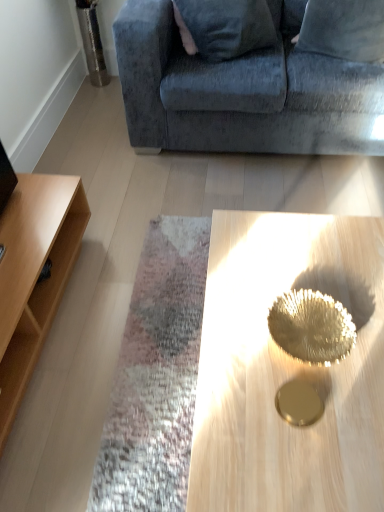
Question: Can you confirm if velvet blue couch at upper center is bigger than gold metallic tray at center?

Choices:
 (A) no
 (B) yes

Answer: (B)

Question: Considering the relative sizes of velvet blue couch at upper center and gold metallic tray at center in the image provided, is velvet blue couch at upper center thinner than gold metallic tray at center?

Choices:
 (A) no
 (B) yes

Answer: (A)

Question: Does velvet blue couch at upper center have a lesser height compared to gold metallic tray at center?

Choices:
 (A) yes
 (B) no

Answer: (B)

Question: From a real-world perspective, is velvet blue couch at upper center located beneath gold metallic tray at center?

Choices:
 (A) yes
 (B) no

Answer: (B)

Question: Could you tell me if velvet blue couch at upper center is turned towards gold metallic tray at center?

Choices:
 (A) yes
 (B) no

Answer: (A)

Question: Does velvet blue couch at upper center appear on the left side of gold metallic tray at center?

Choices:
 (A) yes
 (B) no

Answer: (B)

Question: Does velvet blue couch at upper center have a greater height compared to light wood shelf at left?

Choices:
 (A) yes
 (B) no

Answer: (A)

Question: Considering the relative sizes of velvet blue couch at upper center and light wood shelf at left in the image provided, is velvet blue couch at upper center bigger than light wood shelf at left?

Choices:
 (A) no
 (B) yes

Answer: (B)

Question: Does velvet blue couch at upper center have a lesser width compared to light wood shelf at left?

Choices:
 (A) no
 (B) yes

Answer: (A)

Question: Is velvet blue couch at upper center positioned in front of light wood shelf at left?

Choices:
 (A) no
 (B) yes

Answer: (A)

Question: Is velvet blue couch at upper center shorter than light wood shelf at left?

Choices:
 (A) yes
 (B) no

Answer: (B)

Question: Does velvet blue couch at upper center have a greater width compared to light wood shelf at left?

Choices:
 (A) no
 (B) yes

Answer: (B)

Question: Does gold metallic tray at center have a lesser height compared to velvet blue pillow at upper right?

Choices:
 (A) no
 (B) yes

Answer: (A)